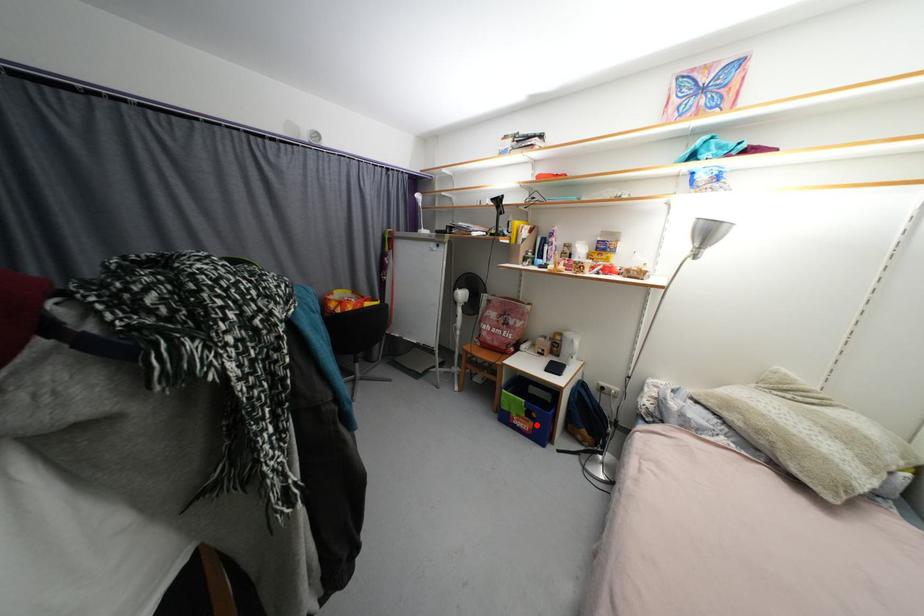
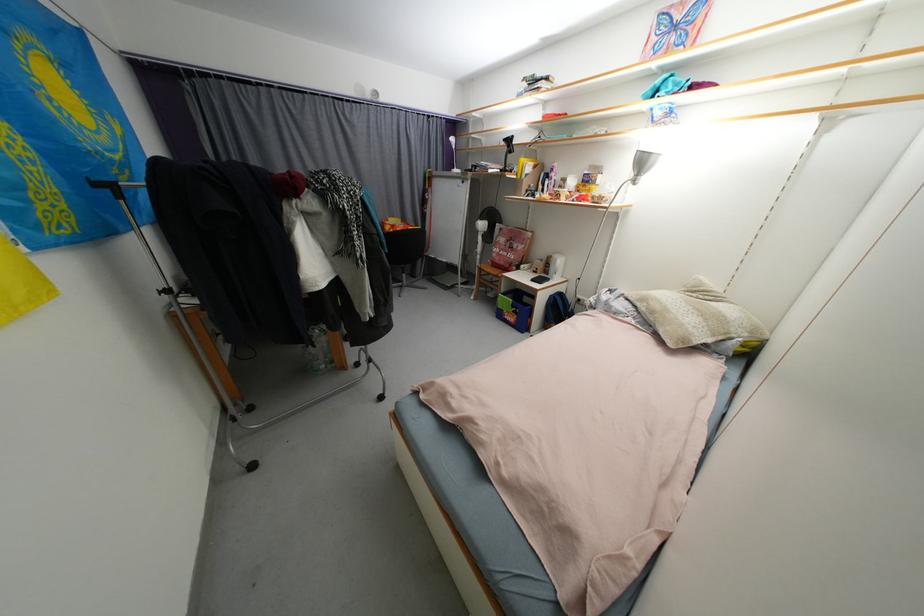
Question: A red point is marked in image1. In image2, is the corresponding 3D point closer to the camera or farther? Reply with the corresponding letter.

Choices:
 (A) The corresponding 3D point is closer.
 (B) The corresponding 3D point is farther.

Answer: (A)